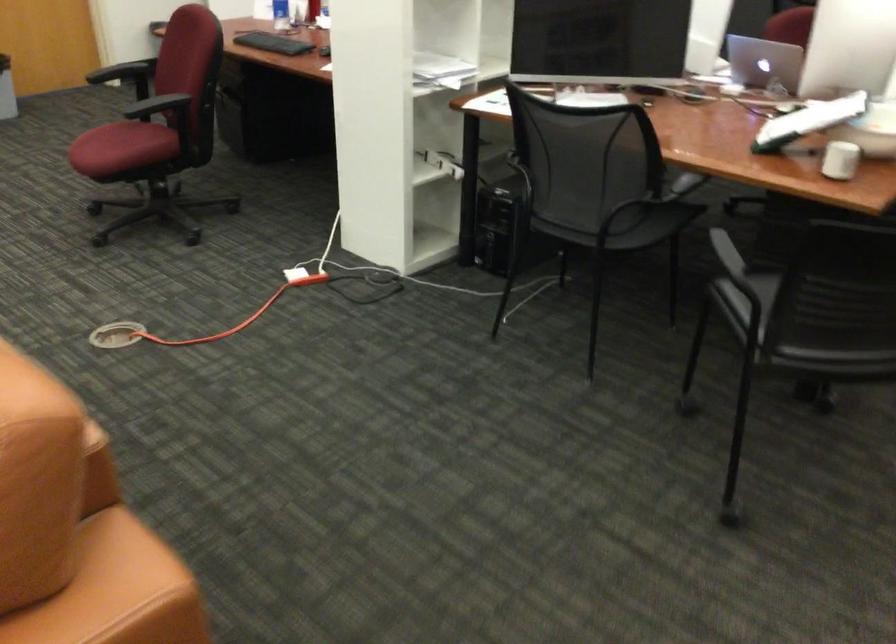
What do you see at coordinates (122, 147) in the screenshot? I see `the red chair sitting surface` at bounding box center [122, 147].